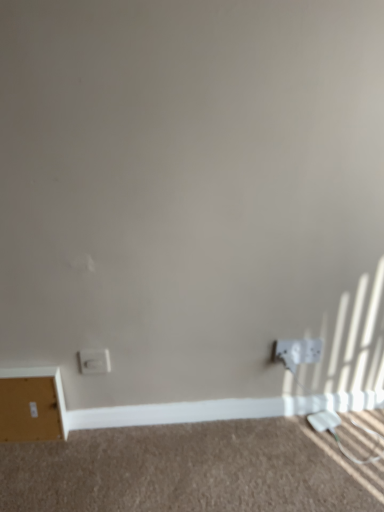
Question: Which is correct: white plastic power plugs and sockets at lower right, acting as the 2th power plugs and sockets starting from the left, is inside white plastic power outlet at lower right, or outside of it?

Choices:
 (A) outside
 (B) inside

Answer: (A)

Question: In terms of size, does white plastic power plugs and sockets at lower right, acting as the 2th power plugs and sockets starting from the left, appear bigger or smaller than white plastic power outlet at lower right?

Choices:
 (A) small
 (B) big

Answer: (B)

Question: Which object is the closest to the white matte file cabinet at lower left?

Choices:
 (A) white plastic power plugs and sockets at lower right, which ranks as the first power plugs and sockets in right-to-left order
 (B) white plastic socket at lower left, the second power plugs and sockets positioned from the right
 (C) white matte baseboard at lower center
 (D) beige carpet at lower center
 (E) white plastic power outlet at lower right

Answer: (B)

Question: Which is nearer to the white plastic power outlet at lower right?

Choices:
 (A) white matte file cabinet at lower left
 (B) white plastic power plugs and sockets at lower right, which ranks as the first power plugs and sockets in right-to-left order
 (C) white plastic socket at lower left, the second power plugs and sockets positioned from the right
 (D) white matte baseboard at lower center
 (E) beige carpet at lower center

Answer: (B)